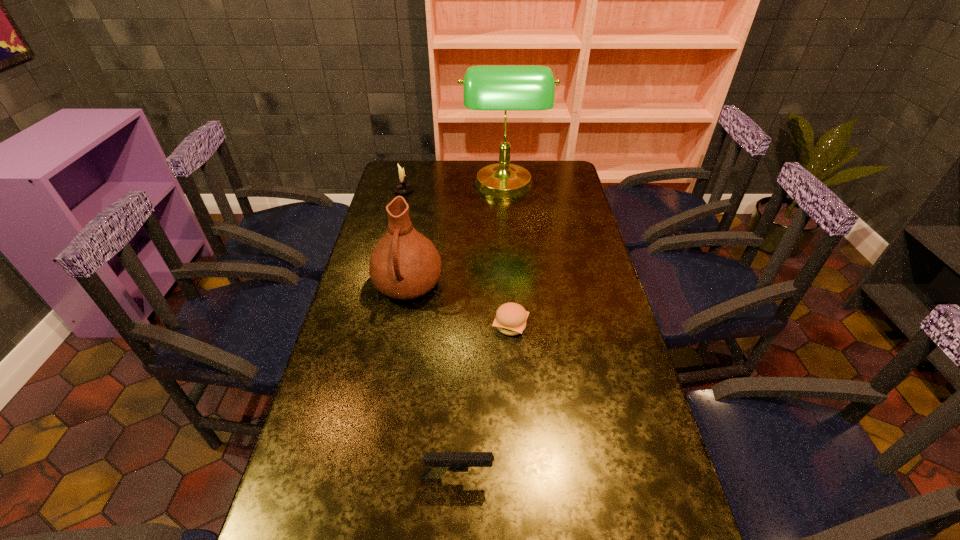
Find the location of a particular element. This screenshot has height=540, width=960. the tallest object is located at coordinates (505, 88).

Locate an element on the screen. the second tallest object is located at coordinates (404, 264).

The height and width of the screenshot is (540, 960). In order to click on candle holder in this screenshot , I will do `click(402, 188)`.

At what (x,y) coordinates should I click in order to perform the action: click on the nearest object. Please return your answer as a coordinate pair (x, y). The width and height of the screenshot is (960, 540). Looking at the image, I should click on (438, 463).

The image size is (960, 540). Identify the location of pistol. (438, 463).

Where is `the shortest object`? This screenshot has height=540, width=960. the shortest object is located at coordinates (510, 319).

In order to click on vacant area located 0.270m on the desk next to the tallest object in this screenshot , I will do (x=398, y=187).

I want to click on vacant space located 0.110m on the desk next to the tallest object, so click(436, 187).

Where is `vacant area situated on the desk next to the tallest object`? This screenshot has height=540, width=960. vacant area situated on the desk next to the tallest object is located at coordinates (392, 187).

You are a GUI agent. You are given a task and a screenshot of the screen. Output one action in this format:
    pyautogui.click(x=<x>, y=<y>)
    Task: Click on the vacant space located on the side of the pitcher with the handle
    The image size is (960, 540).
    Given the screenshot: What is the action you would take?
    pyautogui.click(x=390, y=390)